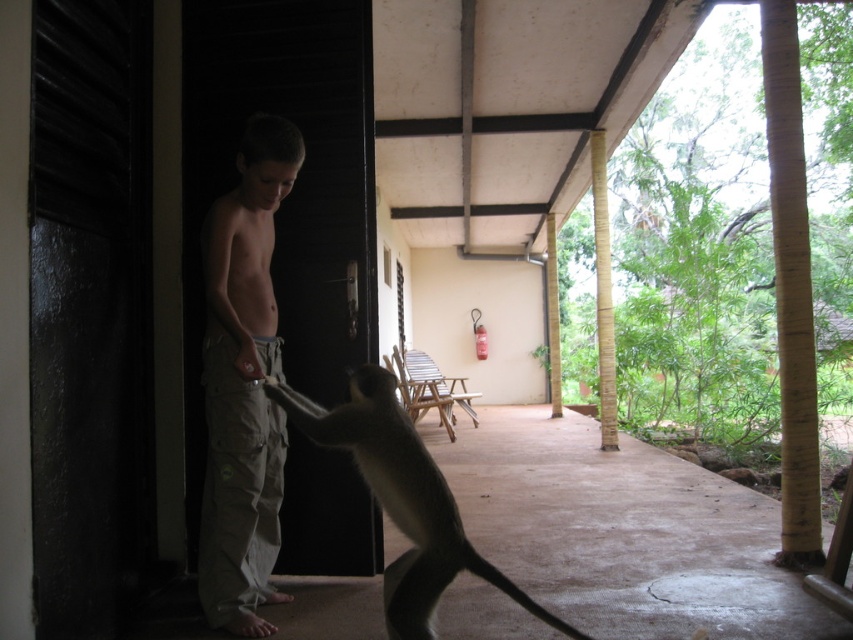
Does smooth bamboo pillar at right appear over yellow bamboo pillar at center-right?

Correct, smooth bamboo pillar at right is located above yellow bamboo pillar at center-right.

Who is shorter, smooth bamboo pillar at right or yellow bamboo pillar at center-right?

With less height is smooth bamboo pillar at right.

You are a GUI agent. You are given a task and a screenshot of the screen. Output one action in this format:
    pyautogui.click(x=<x>, y=<y>)
    Task: Click on the smooth bamboo pillar at right
    The image size is (853, 640).
    Given the screenshot: What is the action you would take?
    pyautogui.click(x=791, y=289)

You are a GUI agent. You are given a task and a screenshot of the screen. Output one action in this format:
    pyautogui.click(x=<x>, y=<y>)
    Task: Click on the smooth bamboo pillar at right
    
    Given the screenshot: What is the action you would take?
    pyautogui.click(x=791, y=289)

Which is more to the right, tan cargo pants at center or brown furry tail at lower center?

Positioned to the right is brown furry tail at lower center.

Which of these two, tan cargo pants at center or brown furry tail at lower center, stands taller?

tan cargo pants at center is taller.

Who is more distant from viewer, (248, 188) or (509, 595)?

Positioned behind is point (248, 188).

You are a GUI agent. You are given a task and a screenshot of the screen. Output one action in this format:
    pyautogui.click(x=<x>, y=<y>)
    Task: Click on the tan cargo pants at center
    
    Given the screenshot: What is the action you would take?
    pyautogui.click(x=242, y=384)

Is point (608, 432) farther from camera compared to point (462, 552)?

Yes.

Does bamboo pole at right have a lesser width compared to brown furry tail at lower center?

Indeed, bamboo pole at right has a lesser width compared to brown furry tail at lower center.

Where is `bamboo pole at right`? bamboo pole at right is located at coordinates (602, 294).

Find the location of a particular element. Image resolution: width=853 pixels, height=640 pixels. bamboo pole at right is located at coordinates (602, 294).